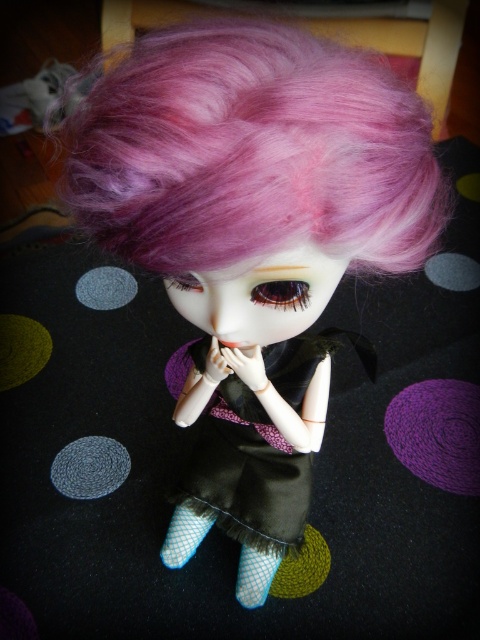
Does brown glossy eye at center have a larger size compared to satin-like purple eye at center?

No.

Which is in front, point (285, 296) or point (189, 284)?

Point (285, 296) is more forward.

This screenshot has height=640, width=480. Find the location of `brown glossy eye at center`. brown glossy eye at center is located at coordinates (282, 294).

Is pink fluffy wig at center positioned behind brown glossy eye at center?

No, pink fluffy wig at center is in front of brown glossy eye at center.

Who is lower down, pink fluffy wig at center or brown glossy eye at center?

brown glossy eye at center is below.

Which is in front, point (415, 115) or point (292, 296)?

Point (415, 115)

You are a GUI agent. You are given a task and a screenshot of the screen. Output one action in this format:
    pyautogui.click(x=<x>, y=<y>)
    Task: Click on the pink fluffy wig at center
    Image resolution: width=480 pixels, height=640 pixels.
    Given the screenshot: What is the action you would take?
    pyautogui.click(x=252, y=152)

Does purple satin dress at center appear under brown glossy eye at center?

Yes.

Is the position of purple satin dress at center less distant than that of brown glossy eye at center?

No, purple satin dress at center is behind brown glossy eye at center.

Is point (230, 484) in front of point (276, 291)?

No, (230, 484) is behind (276, 291).

Where is `purple satin dress at center`? This screenshot has height=640, width=480. purple satin dress at center is located at coordinates (247, 472).